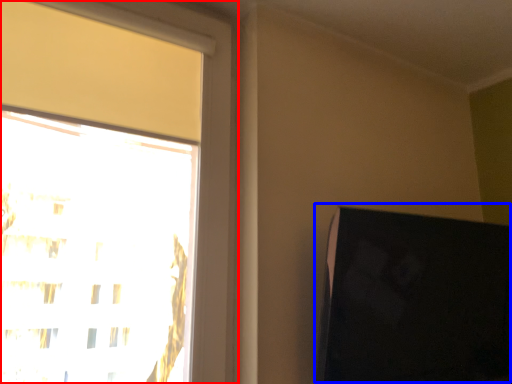
Question: Which object appears farthest to the camera in this image, window (highlighted by a red box) or computer monitor (highlighted by a blue box)?

Choices:
 (A) window
 (B) computer monitor

Answer: (B)